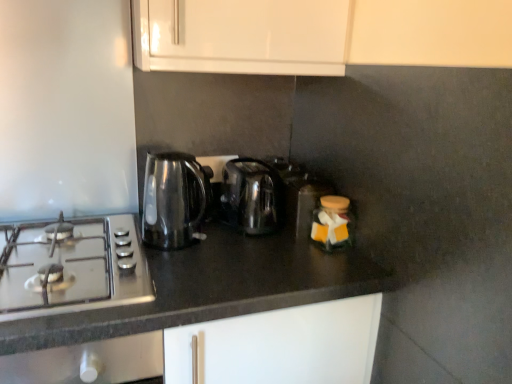
This screenshot has width=512, height=384. Identify the location of free point below transparent glass kettle at left, acting as the 1th kitchen appliance starting from the left (from a real-world perspective). (175, 247).